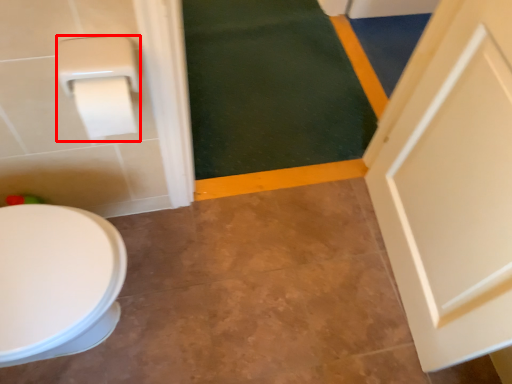
Question: Considering the relative positions of toilet paper (annotated by the red box) and bath mat in the image provided, where is toilet paper (annotated by the red box) located with respect to the staircase?

Choices:
 (A) right
 (B) left

Answer: (B)